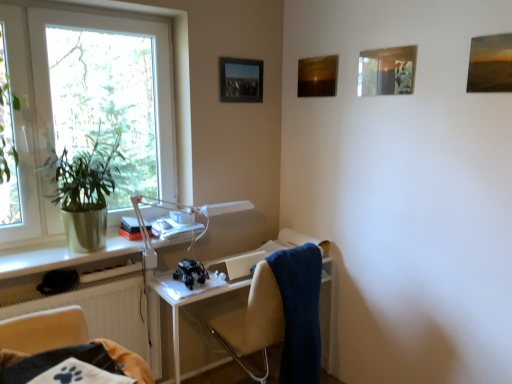
Find the location of a particular element. This screenshot has height=384, width=512. vacant space underneath green leafy plant at left (from a real-world perspective) is located at coordinates [x=101, y=247].